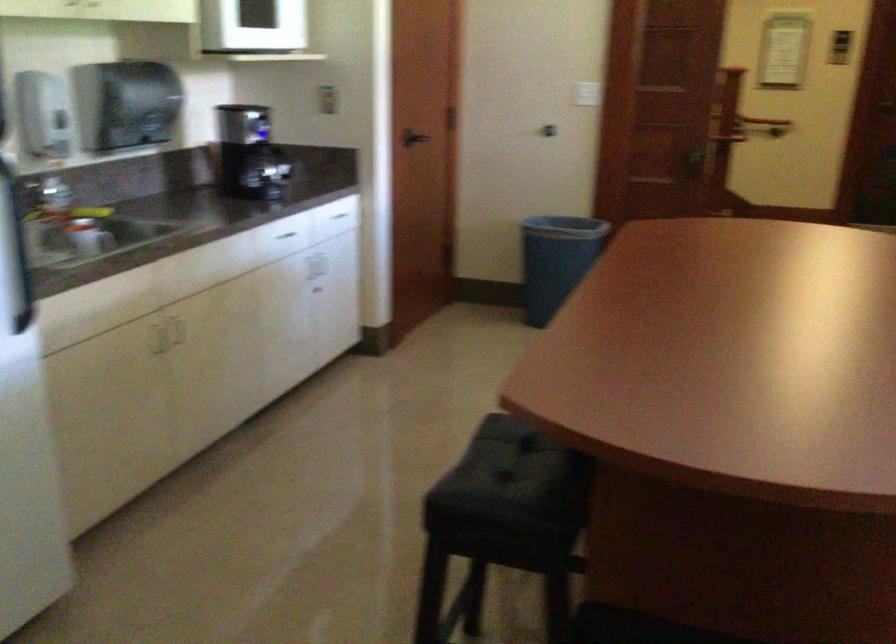
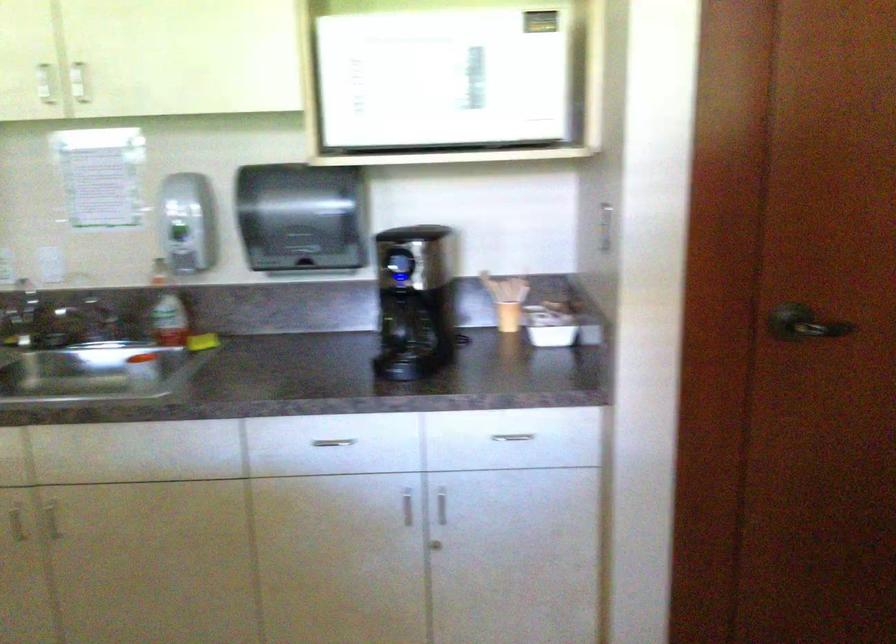
Where in the second image is the point corresponding to point (314, 290) from the first image?

(435, 545)